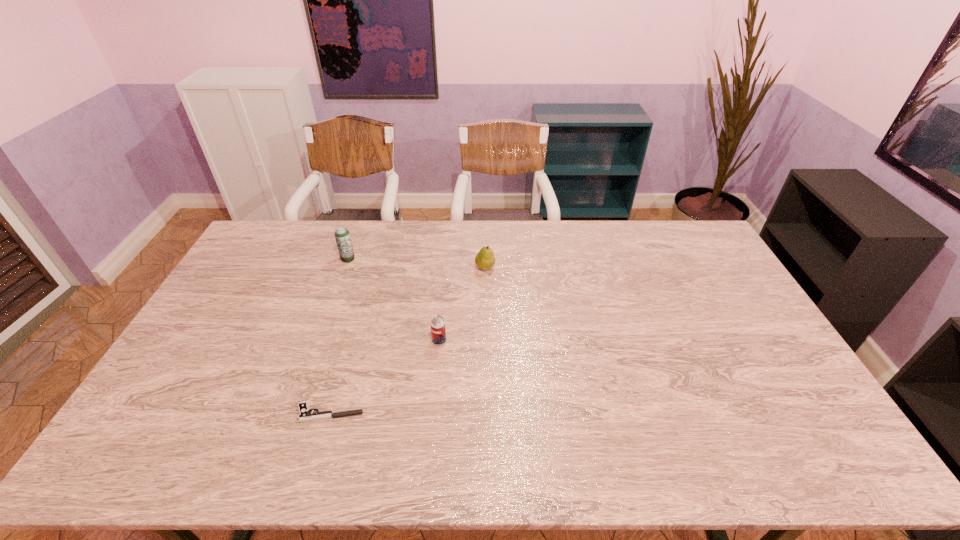
Where is `free space located on the front-facing side of the pistol`? The height and width of the screenshot is (540, 960). free space located on the front-facing side of the pistol is located at coordinates (196, 413).

At what (x,y) coordinates should I click in order to perform the action: click on free spot located on the front-facing side of the pistol. Please return your answer as a coordinate pair (x, y). This screenshot has height=540, width=960. Looking at the image, I should click on (150, 413).

Where is `free region located 0.090m on the front-facing side of the pistol`? Image resolution: width=960 pixels, height=540 pixels. free region located 0.090m on the front-facing side of the pistol is located at coordinates (262, 413).

Identify the location of object at the far edge. The width and height of the screenshot is (960, 540). (342, 235).

Image resolution: width=960 pixels, height=540 pixels. I want to click on free region at the far edge of the desktop, so click(436, 222).

Where is `blank area at the near edge`? The image size is (960, 540). blank area at the near edge is located at coordinates (620, 437).

This screenshot has width=960, height=540. I want to click on blank space at the left edge of the desktop, so click(203, 388).

You are a GUI agent. You are given a task and a screenshot of the screen. Output one action in this format:
    pyautogui.click(x=<x>, y=<y>)
    Task: Click on the vacant space at the right edge of the desktop
    The width and height of the screenshot is (960, 540).
    Given the screenshot: What is the action you would take?
    pyautogui.click(x=795, y=403)

Where is `vacant region at the far left corner of the desktop`? This screenshot has width=960, height=540. vacant region at the far left corner of the desktop is located at coordinates (276, 252).

Where is `vacant area at the near right corner of the desktop`? This screenshot has height=540, width=960. vacant area at the near right corner of the desktop is located at coordinates (801, 458).